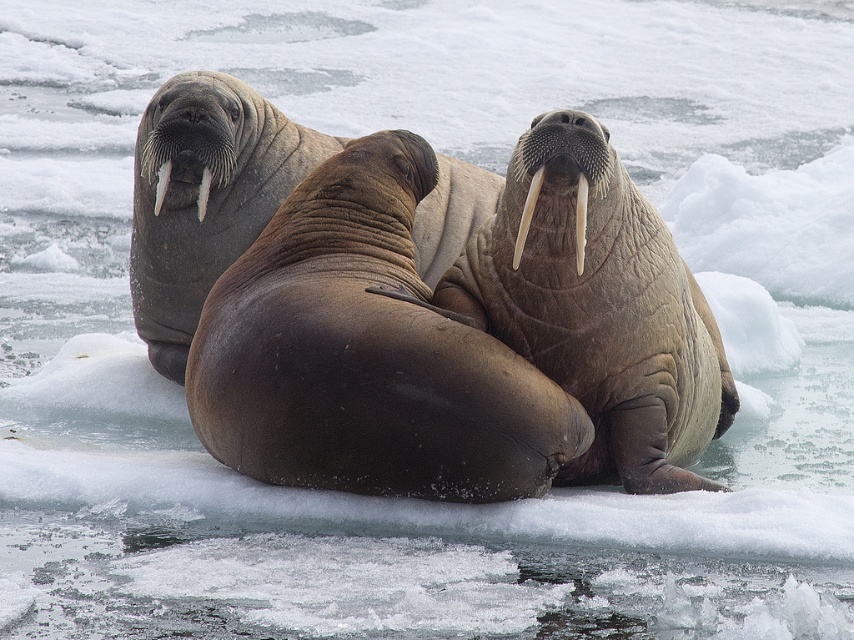
Question: Is brown matte walrus at center further to camera compared to smooth ivory tusk at center?

Choices:
 (A) no
 (B) yes

Answer: (A)

Question: Which point appears closest to the camera in this image?

Choices:
 (A) (535, 198)
 (B) (697, 321)
 (C) (197, 196)
 (D) (219, 198)

Answer: (A)

Question: Which point is closer to the camera?

Choices:
 (A) smooth ivory tusk at center
 (B) brown matte walrus at center
 (C) brown wrinkled skin at center
 (D) white ivory tusk at upper left

Answer: (B)

Question: Observing the image, what is the correct spatial positioning of smooth ivory tusk at center in reference to white ivory tusk at upper left?

Choices:
 (A) right
 (B) left

Answer: (A)

Question: Which is nearer to the white ivory tusk at upper left?

Choices:
 (A) brown matte walrus at center
 (B) brown wrinkled skin at center
 (C) smooth ivory tusk at center
 (D) brown wrinkled walrus at center

Answer: (D)

Question: Is brown wrinkled skin at center positioned behind white ivory tusk at center?

Choices:
 (A) no
 (B) yes

Answer: (A)